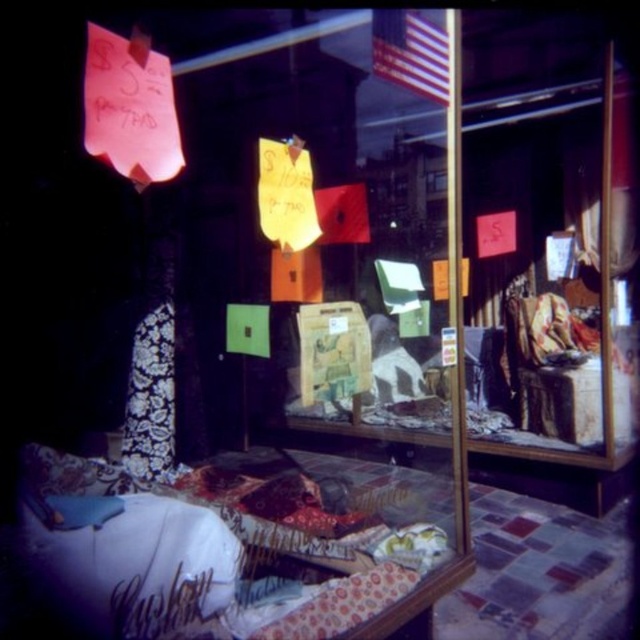
Is point (413, 28) positioned behind point (337, 214)?

That is False.

Identify the location of american flag at upper center. (410, 51).

Looking at this image, which is below, silver metallic script at lower left or red fabric flag at center?

Positioned lower is silver metallic script at lower left.

You are a GUI agent. You are given a task and a screenshot of the screen. Output one action in this format:
    pyautogui.click(x=<x>, y=<y>)
    Task: Click on the silver metallic script at lower left
    
    Given the screenshot: What is the action you would take?
    pyautogui.click(x=160, y=605)

Is american flag at upper center smaller than silver metallic script at lower left?

Actually, american flag at upper center might be larger than silver metallic script at lower left.

Is point (433, 68) more distant than point (115, 621)?

That is True.

Where is `american flag at upper center`? The image size is (640, 640). american flag at upper center is located at coordinates (410, 51).